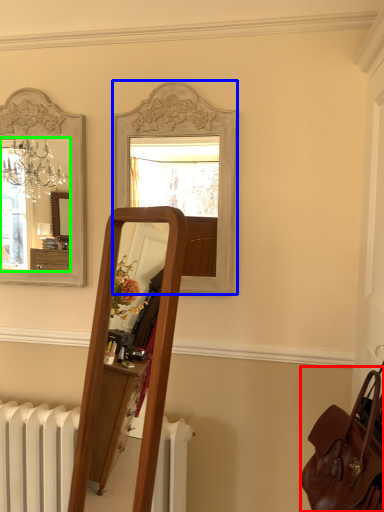
Question: Estimate the real-world distances between objects in this image. Which object is closer to bag (highlighted by a red box), mirror (highlighted by a blue box) or mirror (highlighted by a green box)?

Choices:
 (A) mirror
 (B) mirror

Answer: (A)